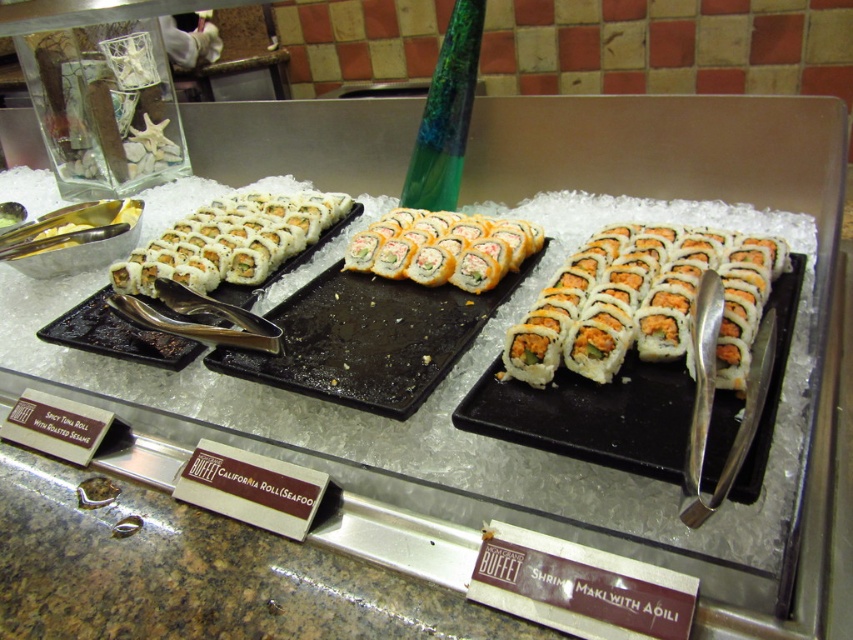
You are a customer at the sushi buffet and want to choose between the white matte sushi roll at center and the orange cream cheese maki at center. Which sushi roll is wider?

The white matte sushi roll at center is wider than the orange cream cheese maki at center.